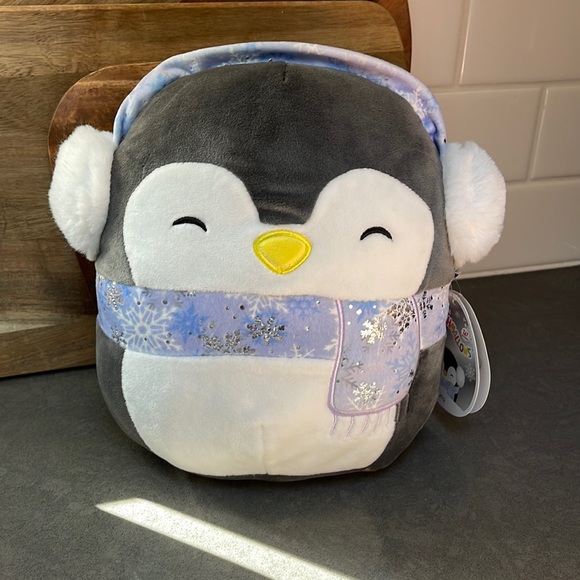
The image size is (580, 580). I want to click on white tile, so click(x=443, y=55), click(x=519, y=50), click(x=500, y=122), click(x=549, y=128), click(x=522, y=224).